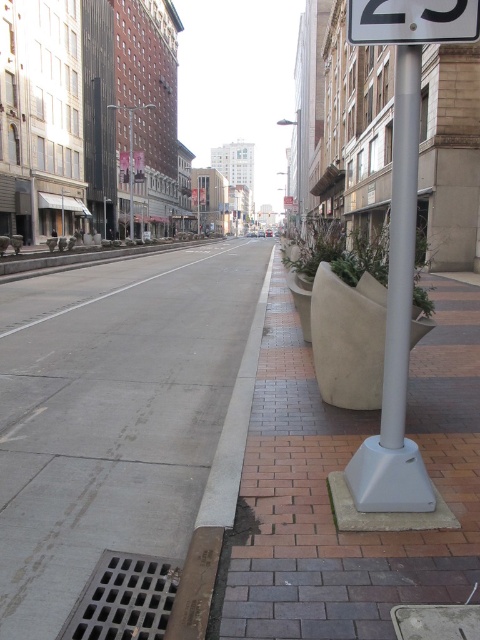
Question: Estimate the real-world distances between objects in this image. Which object is closer to the white smooth pole at right?

Choices:
 (A) white plastic sign at center right
 (B) gray concrete curb at center

Answer: (A)

Question: Which object is farther from the camera taking this photo?

Choices:
 (A) white plastic sign at center right
 (B) gray concrete sidewalk at center

Answer: (A)

Question: Is white smooth pole at right positioned in front of gray concrete curb at center?

Choices:
 (A) no
 (B) yes

Answer: (A)

Question: Is gray concrete sidewalk at center smaller than gray concrete curb at center?

Choices:
 (A) yes
 (B) no

Answer: (B)

Question: Among these points, which one is farthest from the camera?

Choices:
 (A) (245, 428)
 (B) (199, 352)
 (C) (410, 230)
 (D) (420, 470)

Answer: (B)

Question: Can you confirm if white plastic sign at center right is smaller than gray concrete curb at center?

Choices:
 (A) yes
 (B) no

Answer: (A)